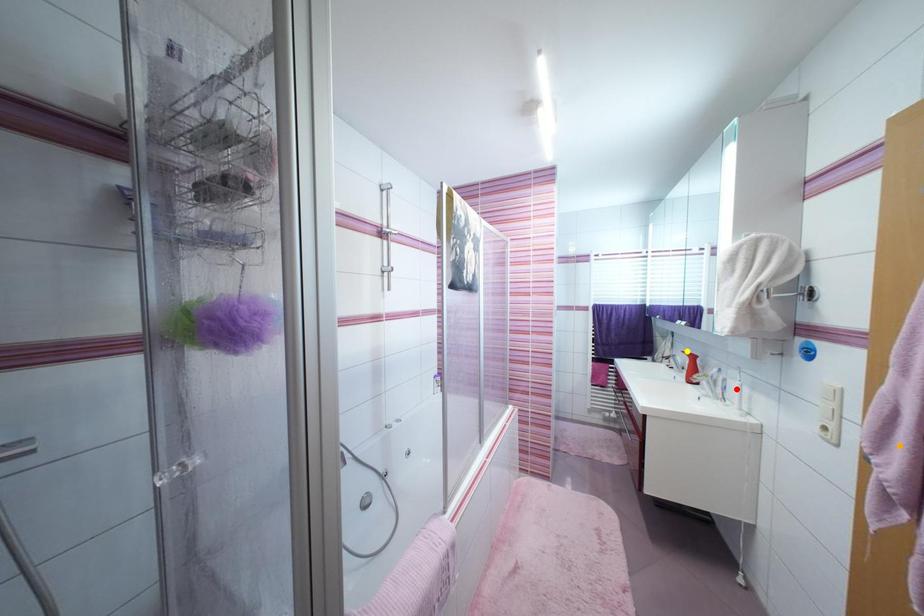
Order these from farthest to nearest:
1. orange point
2. red point
3. yellow point

1. yellow point
2. red point
3. orange point